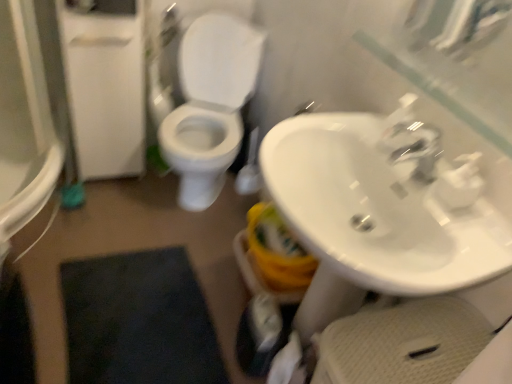
Question: From the image's perspective, relative to white matte toilet paper at lower center, is white glossy toilet at center above or below?

Choices:
 (A) below
 (B) above

Answer: (B)

Question: Is white glossy toilet at center to the left or to the right of white matte toilet paper at lower center in the image?

Choices:
 (A) right
 (B) left

Answer: (B)

Question: Based on their relative distances, which object is farther from the white glossy toilet at center?

Choices:
 (A) white matte toilet paper at lower center
 (B) white glossy sink at center right
 (C) white matte screen door at left

Answer: (A)

Question: Estimate the real-world distances between objects in this image. Which object is farther from the white glossy toilet at center?

Choices:
 (A) white matte toilet paper at lower center
 (B) white matte screen door at left
 (C) white glossy sink at center right

Answer: (A)